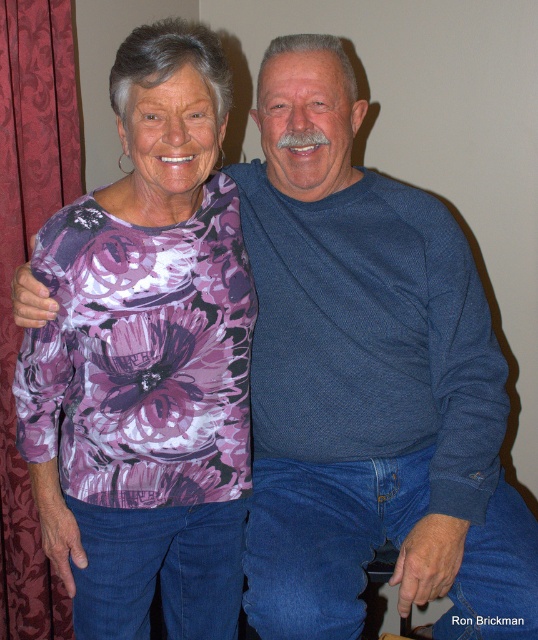
Is point (153, 88) farther from viewer compared to point (51, 100)?

No, (153, 88) is in front of (51, 100).

Can you confirm if floral print shirt at center is positioned to the left of red velvet curtain at left?

No, floral print shirt at center is not to the left of red velvet curtain at left.

Where is `floral print shirt at center`? floral print shirt at center is located at coordinates (147, 358).